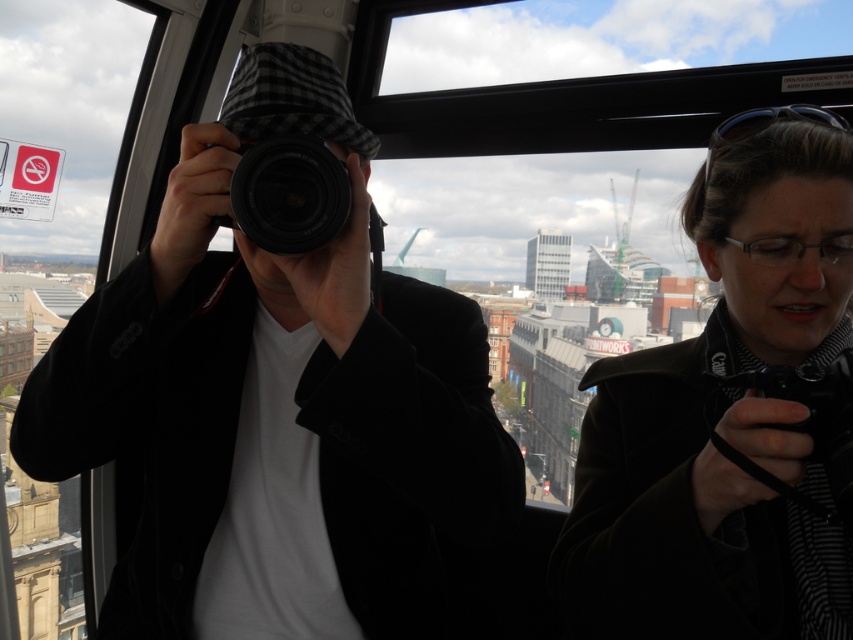
You are a photographer trying to decide which camera to use for a wide landscape shot. Given that the matte black camera at center and the black plastic camera at center are both at the center, which one is more suitable based on their width?

The matte black camera at center is wider than the black plastic camera at center, making it more suitable for a wide landscape shot.

You are standing at the point with coordinates (x=276, y=404) on the observation deck. Which object is directly in front of you?

The point at coordinates (x=276, y=404) corresponds to the matte black camera at center, so the matte black camera at center is directly in front of you.